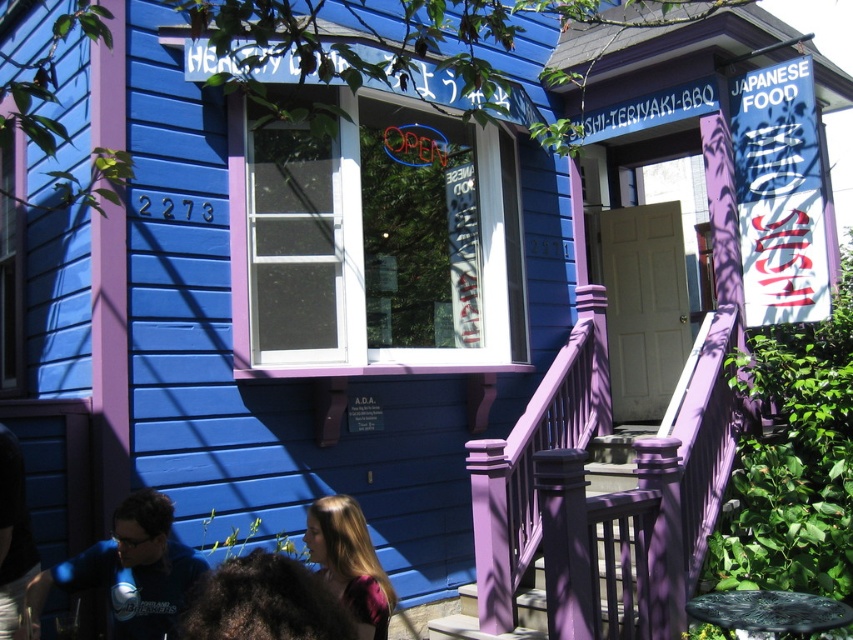
You are a customer looking at the exterior of the building and see a person wearing a blue fabric shirt at lower left and another person with dark curly hair at lower center. Which of the two people is positioned more to the left side of the image?

The blue fabric shirt at lower left is positioned more to the left side of the image than the dark curly hair at lower center.

Consider the image. You are a photographer standing in front of the Japanese restaurant. You notice a person wearing a blue fabric shirt at lower left and has dark brown hair at lower left. Can you tell me which part of their outfit is shorter?

The blue fabric shirt at lower left is shorter than dark brown hair at lower left.